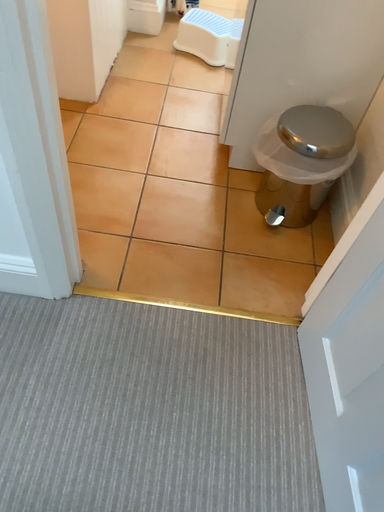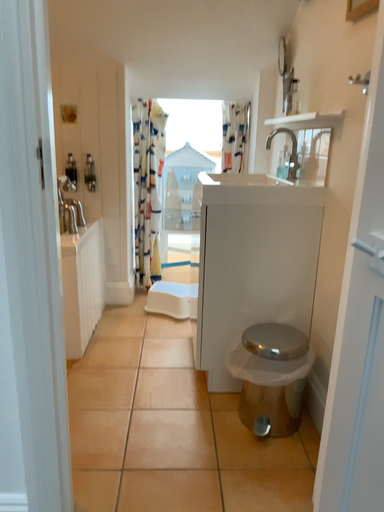
Question: Which way did the camera rotate in the video?

Choices:
 (A) rotated upward
 (B) rotated downward

Answer: (A)